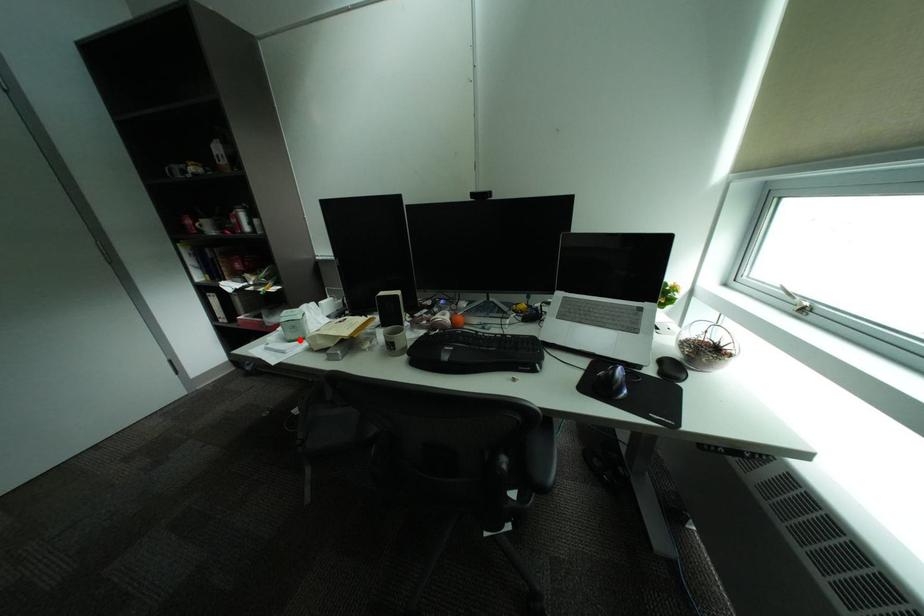
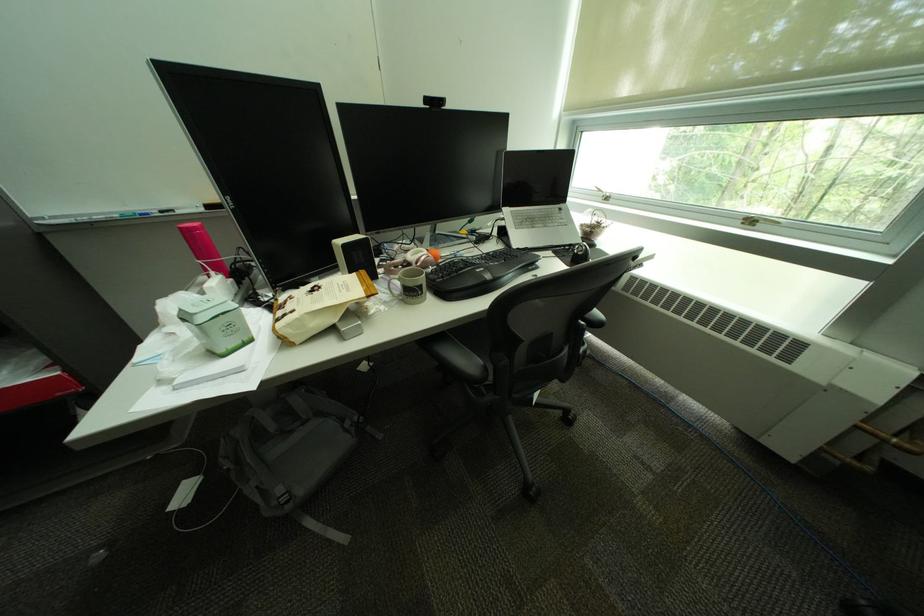
In the second image, find the point that corresponds to the highlighted location in the first image.

(232, 353)